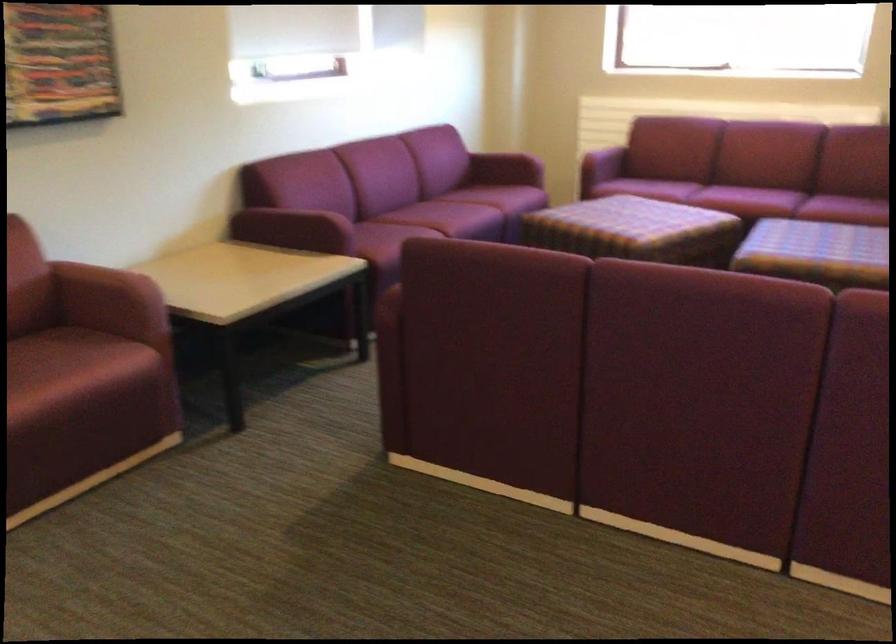
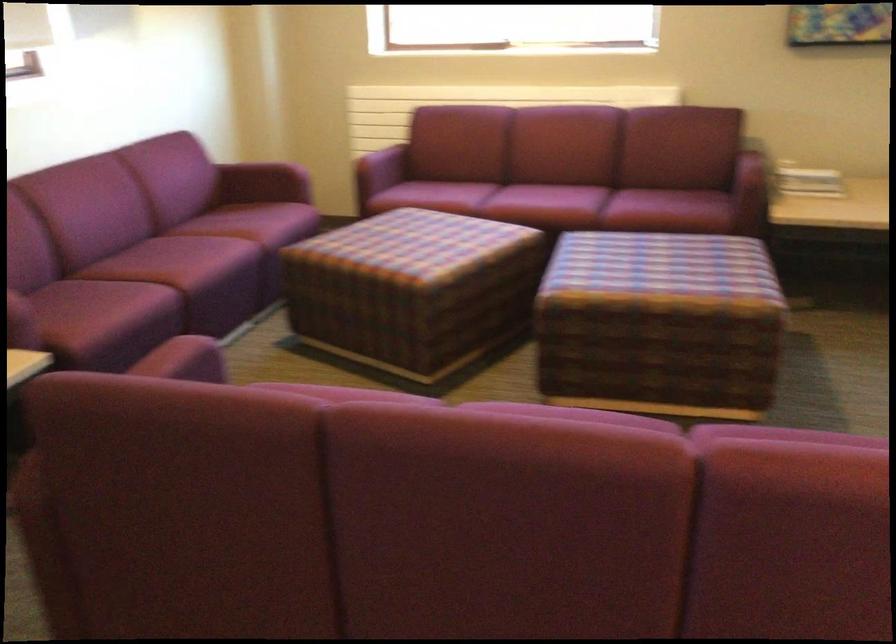
In the second image, find the point that corresponds to (x=630, y=245) in the first image.

(412, 289)